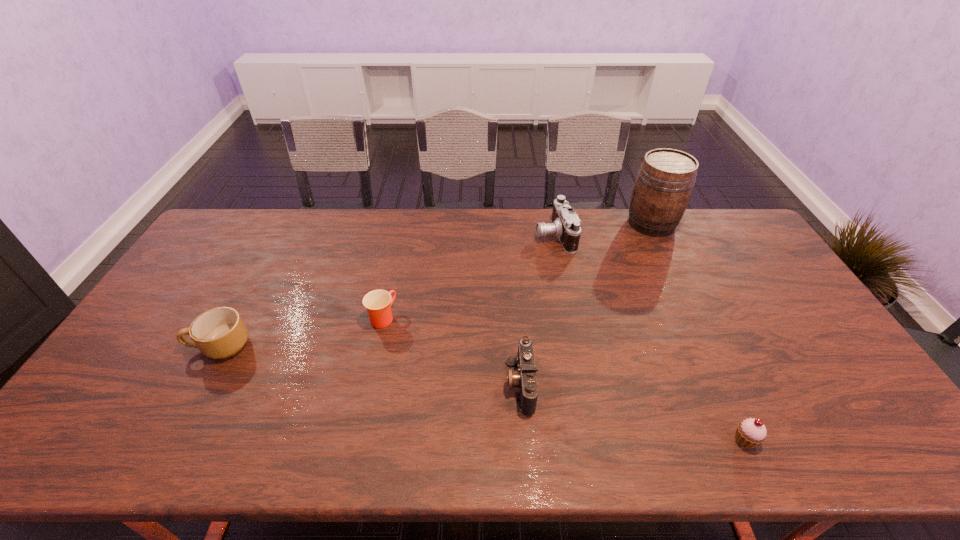
At what (x,y) coordinates should I click in order to perform the action: click on cider. Please return your answer as a coordinate pair (x, y). This screenshot has width=960, height=540. Looking at the image, I should click on (663, 187).

Locate an element on the screen. The width and height of the screenshot is (960, 540). the third object from right to left is located at coordinates (565, 225).

Identify the location of the fifth shortest object. The width and height of the screenshot is (960, 540). (565, 225).

Locate an element on the screen. The height and width of the screenshot is (540, 960). mug is located at coordinates (218, 333).

Identify the location of the left camera. The height and width of the screenshot is (540, 960). (525, 379).

This screenshot has width=960, height=540. Identify the location of the shorter camera. (525, 379).

Identify the location of the fifth object from right to left. (378, 303).

Find the location of `the nearest object`. the nearest object is located at coordinates (750, 432).

Identify the location of vacant point located on the side of the tallest object near the bung hole. The width and height of the screenshot is (960, 540). (582, 224).

Identify the location of free space located on the side of the tallest object near the bung hole. The image size is (960, 540). (525, 224).